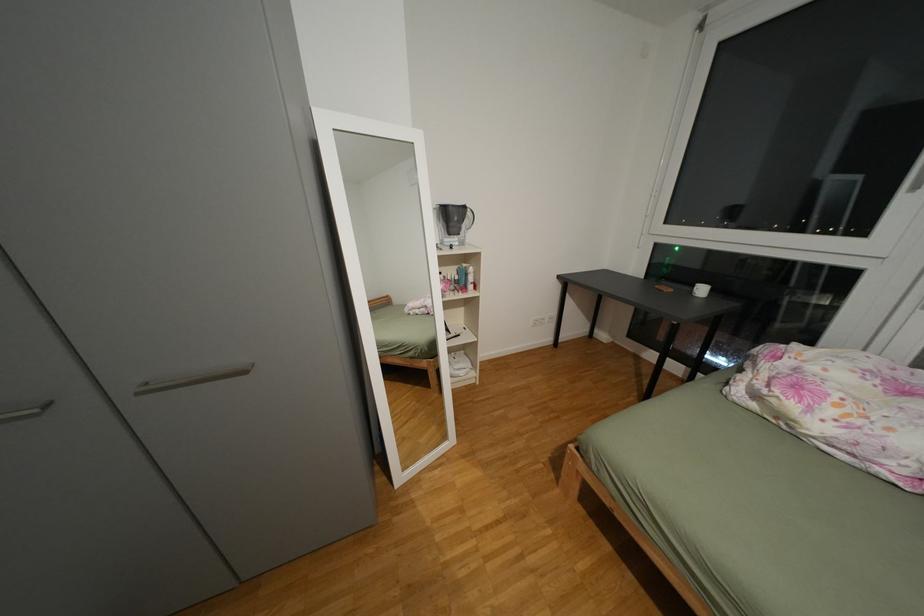
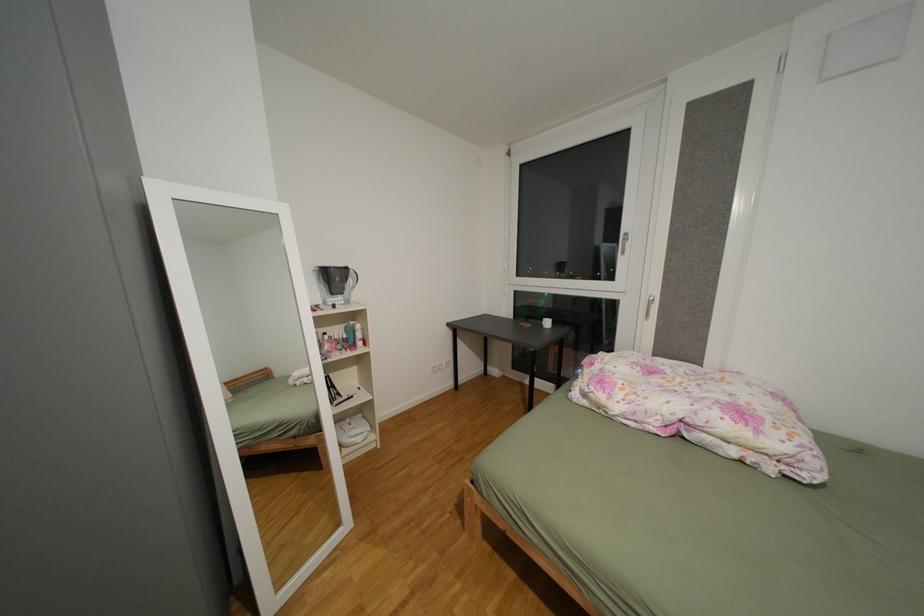
Question: How did the camera likely rotate?

Choices:
 (A) Left
 (B) Right
 (C) Up
 (D) Down

Answer: (B)